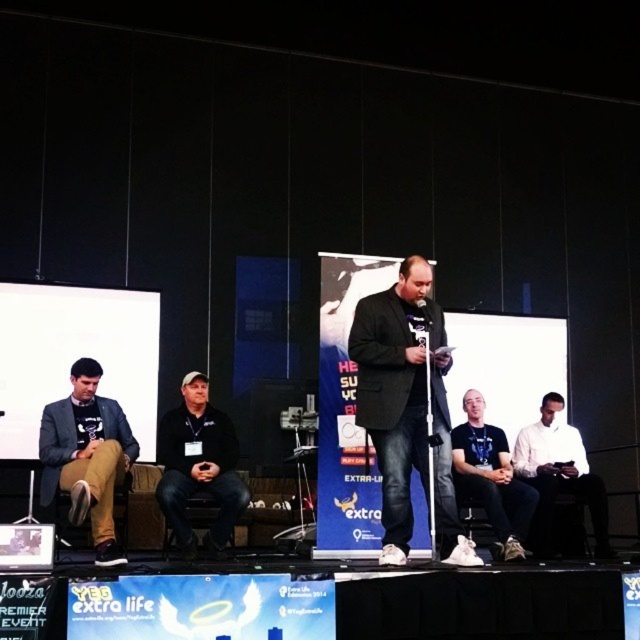
Does dark gray blazer at center appear on the left side of white matte shirt at center?

Correct, you'll find dark gray blazer at center to the left of white matte shirt at center.

Does dark gray blazer at center come in front of white matte shirt at center?

That is True.

Who is more forward, (397, 531) or (481, 481)?

Point (397, 531)

Where is `dark gray blazer at center`? dark gray blazer at center is located at coordinates (406, 408).

Is point (67, 445) positioned in front of point (218, 433)?

Yes, point (67, 445) is closer to viewer.

Who is positioned more to the right, matte black jacket at left or black fabric cap at center?

black fabric cap at center

Consider the image. Who is more distant from viewer, (80,484) or (166,486)?

Point (166,486)

Locate an element on the screen. Image resolution: width=640 pixels, height=640 pixels. matte black jacket at left is located at coordinates (86, 456).

Between point (364, 374) and point (598, 545), which one is positioned in front?

Point (364, 374)

Does dark gray blazer at center have a greater height compared to white shirt at right?

Indeed, dark gray blazer at center has a greater height compared to white shirt at right.

Where is `dark gray blazer at center`? dark gray blazer at center is located at coordinates (406, 408).